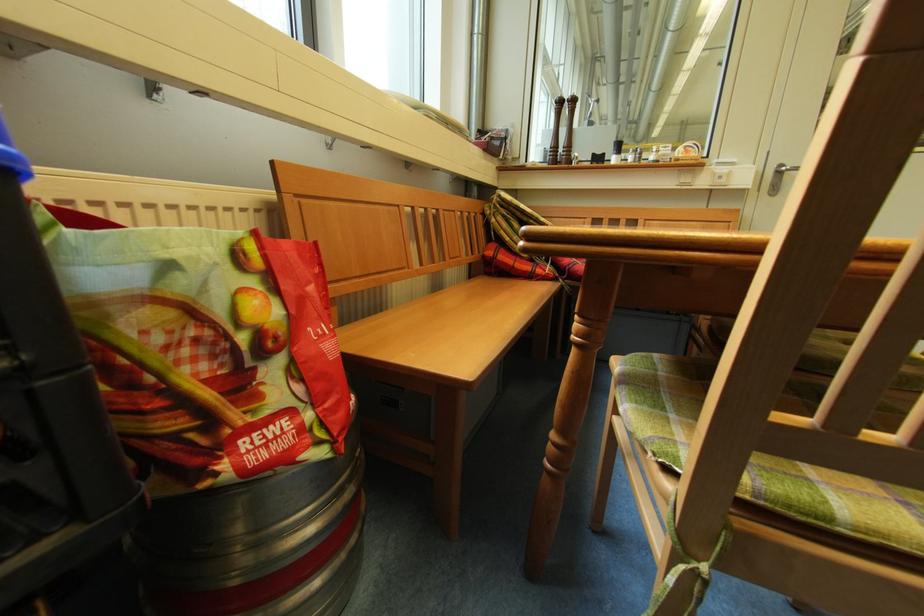
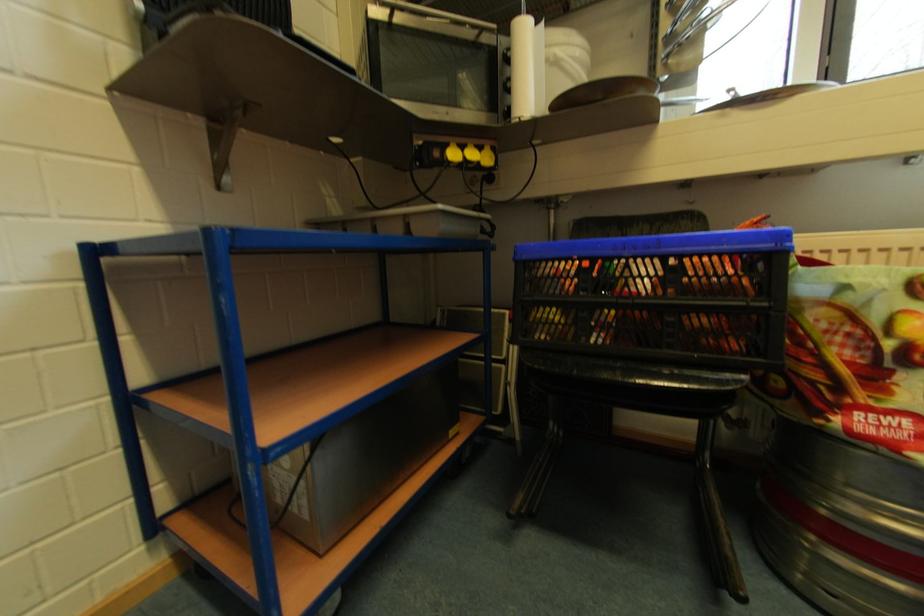
Question: The images are taken continuously from a first-person perspective. In which direction is your viewpoint rotating?

Choices:
 (A) Left
 (B) Right
 (C) Up
 (D) Down

Answer: (A)